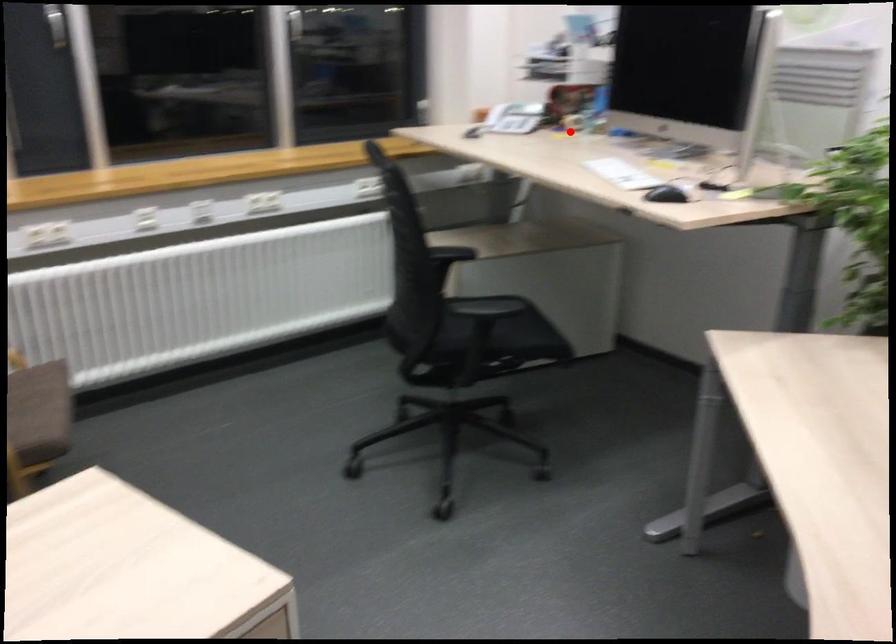
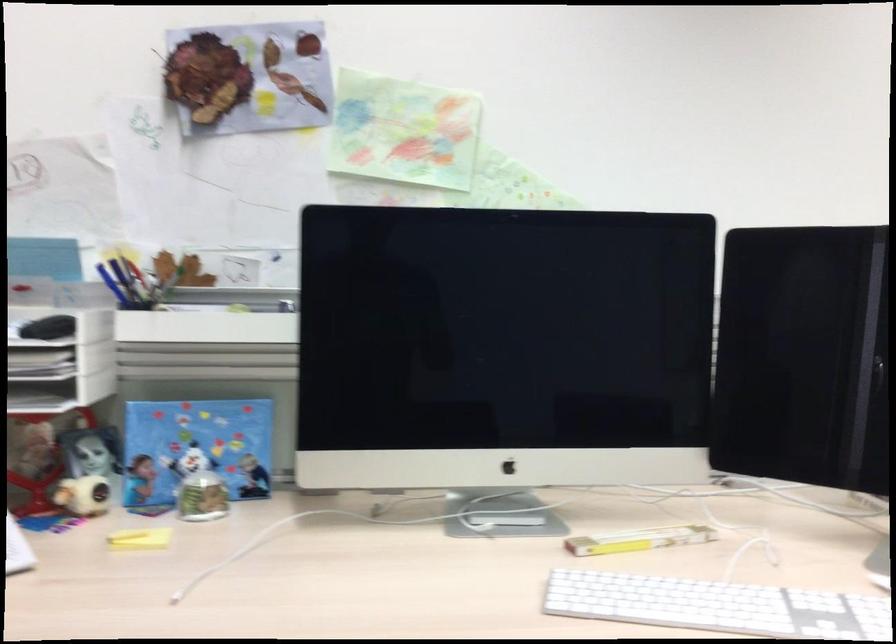
Question: I am providing you with two images of the same scene from different viewpoints. A red point is marked on the first image. At the location where the point appears in image 1, is it still visible in image 2?

Choices:
 (A) Yes
 (B) No

Answer: (A)